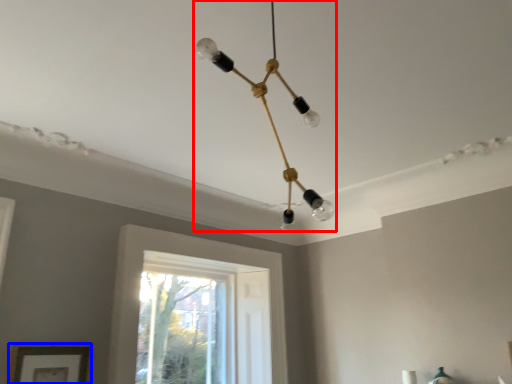
Question: Which point is closer to the camera, lamp (highlighted by a red box) or picture frame (highlighted by a blue box)?

Choices:
 (A) lamp
 (B) picture frame

Answer: (A)